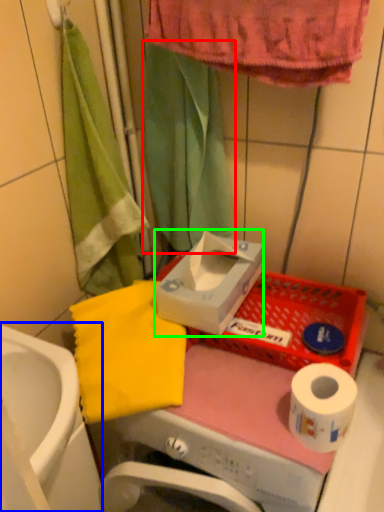
Question: Estimate the real-world distances between objects in this image. Which object is farther from shower curtain (highlighted by a red box), sink (highlighted by a blue box) or carton (highlighted by a green box)?

Choices:
 (A) sink
 (B) carton

Answer: (A)